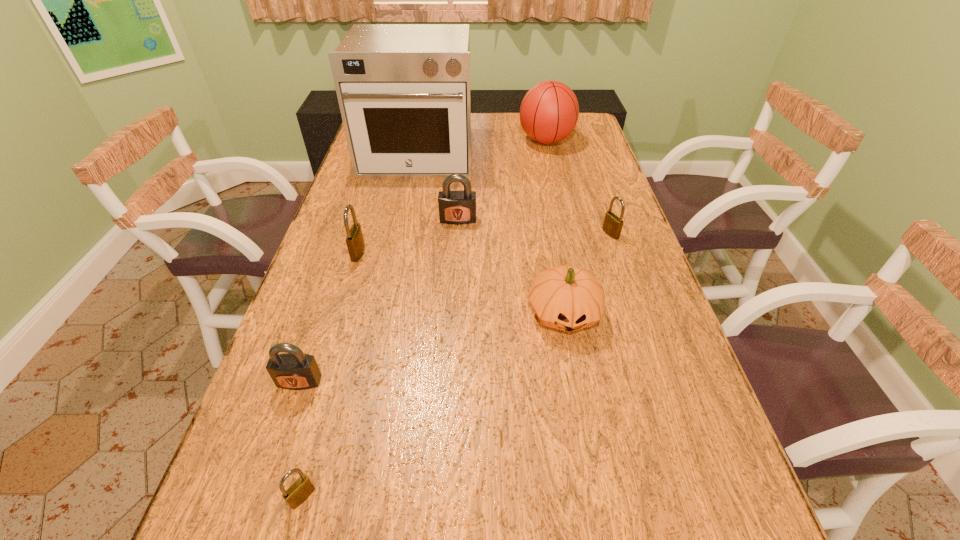
Locate an element on the screen. free space located 0.070m on the front of the second nearest object near the keyhole is located at coordinates (285, 424).

Locate an element on the screen. Image resolution: width=960 pixels, height=540 pixels. free space located on the right of the nearest padlock is located at coordinates (523, 497).

The height and width of the screenshot is (540, 960). Find the location of `toaster oven located in the far edge section of the desktop`. toaster oven located in the far edge section of the desktop is located at coordinates (403, 90).

Where is `basketball that is at the far edge`? basketball that is at the far edge is located at coordinates (549, 111).

Where is `toaster oven present at the left edge`? The image size is (960, 540). toaster oven present at the left edge is located at coordinates (403, 90).

I want to click on basketball located at the right edge, so click(x=549, y=111).

Find the location of a particular element. The image size is (960, 540). gourd located at the right edge is located at coordinates (567, 298).

Find the location of `padlock positioned at the right edge`. padlock positioned at the right edge is located at coordinates [612, 226].

You are a GUI agent. You are given a task and a screenshot of the screen. Output one action in this format:
    pyautogui.click(x=<x>, y=<y>)
    Task: Click on the object that is positioned at the far left corner
    
    Given the screenshot: What is the action you would take?
    point(403,90)

The width and height of the screenshot is (960, 540). I want to click on object situated at the far right corner, so [549, 111].